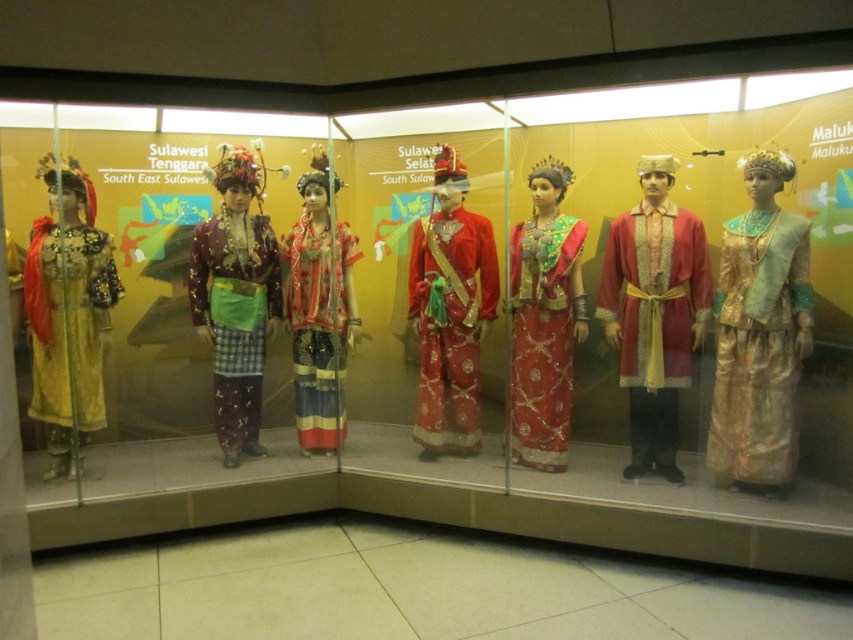
Question: Can you confirm if gold silk dress at right is positioned to the right of plaid fabric skirt at center?

Choices:
 (A) yes
 (B) no

Answer: (A)

Question: Which of the following is the farthest from the observer?

Choices:
 (A) (257, 250)
 (B) (296, 225)
 (C) (57, 378)

Answer: (B)

Question: Which point appears closest to the camera in this image?

Choices:
 (A) (741, 241)
 (B) (248, 227)
 (C) (656, 460)

Answer: (A)

Question: Is matte gold robe at center positioned in front of plaid fabric skirt at center?

Choices:
 (A) no
 (B) yes

Answer: (B)

Question: Can you confirm if shiny red fabric dress at center is positioned above matte gold dress at left?

Choices:
 (A) no
 (B) yes

Answer: (A)

Question: Which of the following is the closest to the observer?

Choices:
 (A) matte gold robe at center
 (B) plaid fabric skirt at center
 (C) shiny red fabric at center
 (D) matte gold dress at left

Answer: (D)